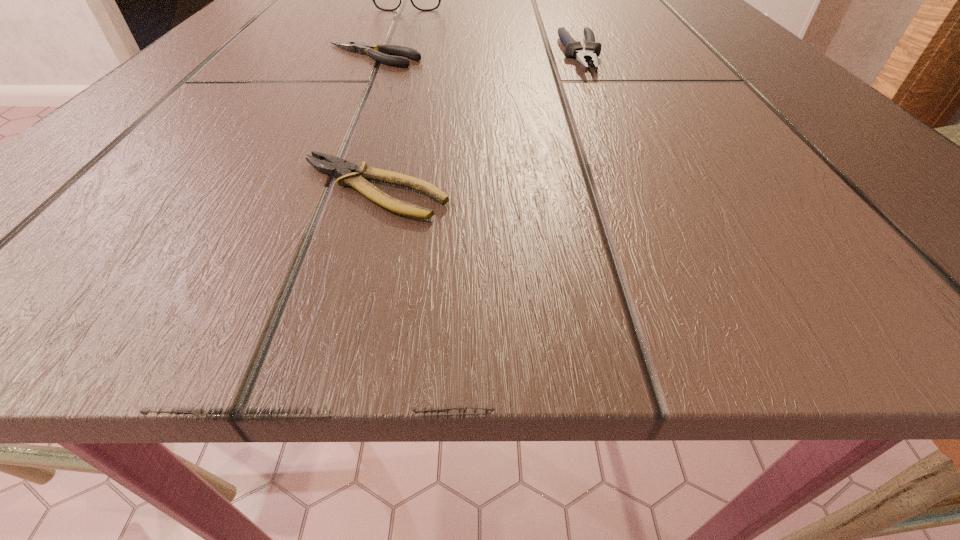
The image size is (960, 540). Identify the location of the third shortest object. [x=573, y=48].

I want to click on the rightmost pliers, so click(573, 48).

The image size is (960, 540). Find the location of `the shortest object`. the shortest object is located at coordinates (350, 175).

This screenshot has height=540, width=960. I want to click on the nearest pliers, so click(x=350, y=175).

The image size is (960, 540). Find the location of `vacant point located at the gripping part of the tallest pliers`. vacant point located at the gripping part of the tallest pliers is located at coordinates (599, 98).

Where is `free space located on the right of the nearest pliers`? This screenshot has width=960, height=540. free space located on the right of the nearest pliers is located at coordinates (517, 188).

Locate an element on the screen. The width and height of the screenshot is (960, 540). object located in the near edge section of the desktop is located at coordinates (350, 175).

Find the location of a particular element. The width and height of the screenshot is (960, 540). vacant space at the far edge is located at coordinates (387, 12).

Where is `vacant region at the left edge`? This screenshot has height=540, width=960. vacant region at the left edge is located at coordinates (227, 83).

Identify the location of vacant space at the right edge of the desktop. This screenshot has width=960, height=540. (747, 70).